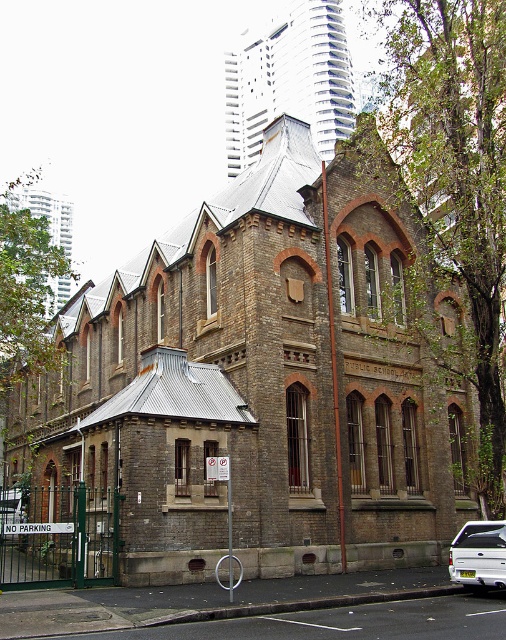
Does brick church at upper center appear under white matte pickup truck at lower right?

Actually, brick church at upper center is above white matte pickup truck at lower right.

I want to click on brick church at upper center, so click(288, 80).

Who is more distant from viewer, (246,33) or (465,580)?

Point (246,33)

Where is `brick church at upper center`? brick church at upper center is located at coordinates (288, 80).

Does brown brick church at center appear on the right side of brick church at upper center?

No, brown brick church at center is not to the right of brick church at upper center.

Is the position of brown brick church at center more distant than that of brick church at upper center?

No, brown brick church at center is closer to the viewer.

Locate an element on the screen. brown brick church at center is located at coordinates (265, 378).

Does brown brick church at center have a greater height compared to white matte pickup truck at lower right?

Yes, brown brick church at center is taller than white matte pickup truck at lower right.

Does point (284, 403) lie behind point (480, 561)?

Yes.

Image resolution: width=506 pixels, height=640 pixels. Find the location of `brown brick church at center`. brown brick church at center is located at coordinates (265, 378).